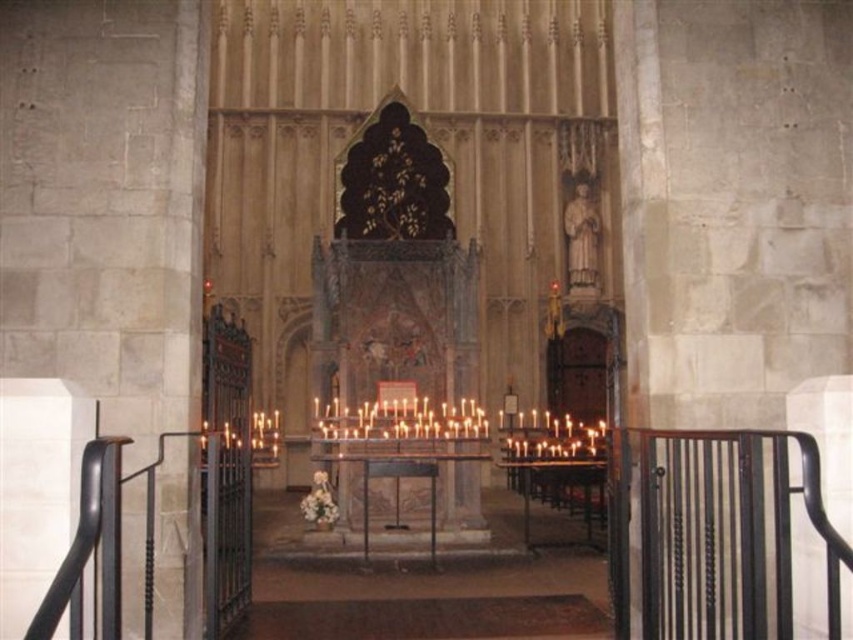
You are standing at the entrance of the cathedral and see two points marked in the scene. The first point is at coordinate point (834, 566) and the second is at point (219, 572). Which point is closer to you?

Point (834, 566) is in front of point (219, 572), so it is closer to you.